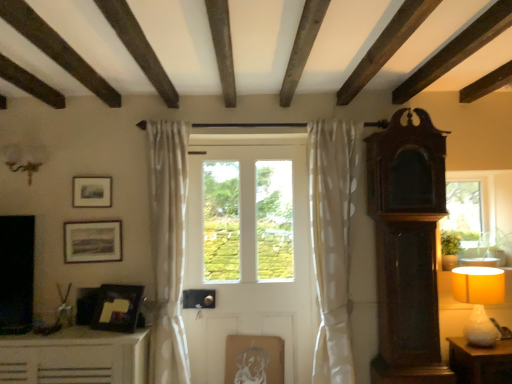
Question: From the image's perspective, is dark wood grandfather clock at right on wooden table at right?

Choices:
 (A) yes
 (B) no

Answer: (A)

Question: Can you confirm if dark wood grandfather clock at right is taller than wooden table at right?

Choices:
 (A) yes
 (B) no

Answer: (A)

Question: Can you confirm if dark wood grandfather clock at right is thinner than wooden table at right?

Choices:
 (A) no
 (B) yes

Answer: (B)

Question: Considering the relative sizes of dark wood grandfather clock at right and wooden table at right in the image provided, is dark wood grandfather clock at right bigger than wooden table at right?

Choices:
 (A) no
 (B) yes

Answer: (B)

Question: Would you consider dark wood grandfather clock at right to be distant from wooden table at right?

Choices:
 (A) yes
 (B) no

Answer: (B)

Question: Does dark wood grandfather clock at right appear on the right side of wooden table at right?

Choices:
 (A) no
 (B) yes

Answer: (A)

Question: Considering the relative sizes of matte yellow fabric lampshade at right and matte black picture frame at upper left, the 2th picture frame in the back-to-front sequence, in the image provided, is matte yellow fabric lampshade at right thinner than matte black picture frame at upper left, the 2th picture frame in the back-to-front sequence,?

Choices:
 (A) no
 (B) yes

Answer: (A)

Question: Are matte yellow fabric lampshade at right and matte black picture frame at upper left, which appears as the third picture frame when viewed from the front, located far from each other?

Choices:
 (A) yes
 (B) no

Answer: (A)

Question: Is matte yellow fabric lampshade at right closer to the viewer compared to matte black picture frame at upper left, placed as the 1th picture frame when sorted from top to bottom?

Choices:
 (A) no
 (B) yes

Answer: (B)

Question: Can you confirm if matte yellow fabric lampshade at right is bigger than matte black picture frame at upper left, which is the fourth picture frame from right to left?

Choices:
 (A) no
 (B) yes

Answer: (B)

Question: Is matte yellow fabric lampshade at right further to camera compared to matte black picture frame at upper left, which appears as the third picture frame when viewed from the front?

Choices:
 (A) no
 (B) yes

Answer: (A)

Question: Are matte yellow fabric lampshade at right and matte black picture frame at upper left, marked as the first picture frame in a left-to-right arrangement, making contact?

Choices:
 (A) no
 (B) yes

Answer: (A)

Question: Is matte wooden picture frame at upper left, placed as the third picture frame when sorted from back to front, wider than white sheer curtain at left, arranged as the second curtain when viewed from the right?

Choices:
 (A) yes
 (B) no

Answer: (B)